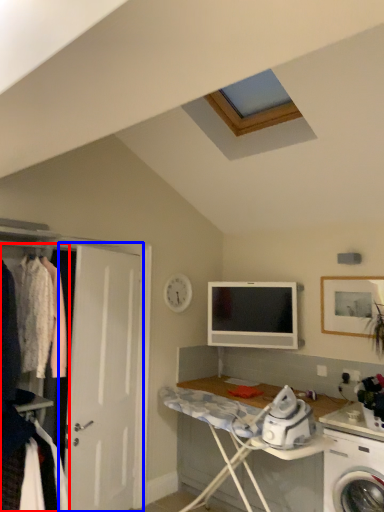
Question: Which object is further to the camera taking this photo, closet (highlighted by a red box) or door (highlighted by a blue box)?

Choices:
 (A) closet
 (B) door

Answer: (B)